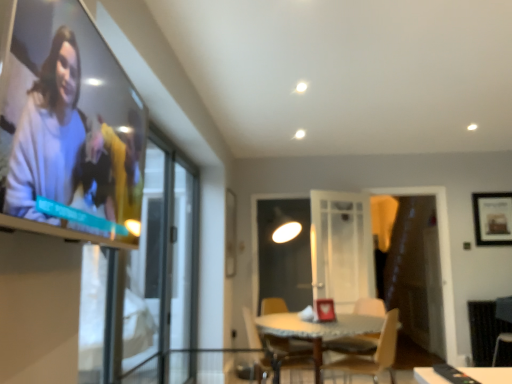
Identify the location of free space above transparent glass screen door at left, which is the 1th screen door in back-to-front order (from a real-world perspective). (185, 155).